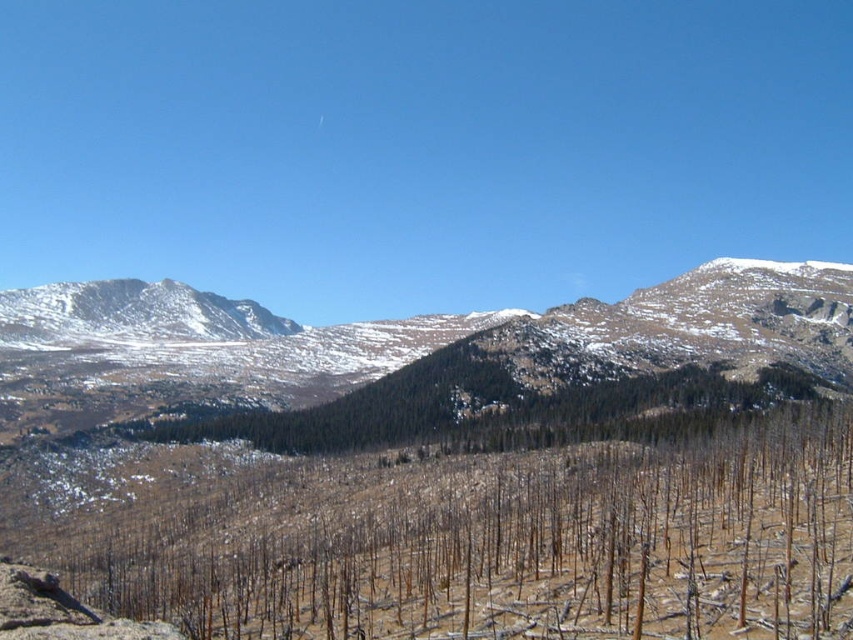
What do you see at coordinates (383, 340) in the screenshot? Image resolution: width=853 pixels, height=640 pixels. I see `snowy rocky mountain at center` at bounding box center [383, 340].

Can you confirm if snowy rocky mountain at center is taller than snowy rocky mountain at left?

Yes, snowy rocky mountain at center is taller than snowy rocky mountain at left.

Between point (183, 289) and point (112, 321), which one is positioned behind?

The point (183, 289) is behind.

The height and width of the screenshot is (640, 853). In order to click on snowy rocky mountain at center in this screenshot , I will do `click(383, 340)`.